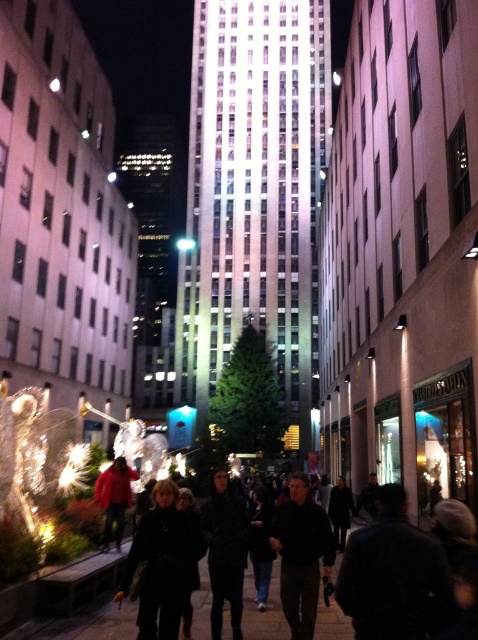
Is point (165, 522) positioned behind point (400, 529)?

Yes, it is behind point (400, 529).

Can you confirm if black leather coat at center is smaller than black matte crowd at center?

Indeed, black leather coat at center has a smaller size compared to black matte crowd at center.

Based on the photo, who is more distant from viewer, (x=152, y=513) or (x=250, y=634)?

Positioned behind is point (x=152, y=513).

Locate an element on the screen. This screenshot has width=478, height=640. black leather coat at center is located at coordinates (161, 564).

Does dark gray sweater at center have a larger size compared to black matte crowd at center?

Actually, dark gray sweater at center might be smaller than black matte crowd at center.

Does dark gray sweater at center appear on the left side of black matte crowd at center?

Incorrect, dark gray sweater at center is not on the left side of black matte crowd at center.

Is point (279, 518) in front of point (358, 528)?

Yes.

Where is `dark gray sweater at center`? The height and width of the screenshot is (640, 478). dark gray sweater at center is located at coordinates (301, 554).

Between point (304, 625) and point (115, 497), which one is positioned behind?

Positioned behind is point (115, 497).

Measure the distance between dark gray sweater at center and camera.

100.04 feet

Is point (322, 524) farther from viewer compared to point (102, 502)?

No, it is not.

Find the location of a particular element. The width and height of the screenshot is (478, 640). dark gray sweater at center is located at coordinates (301, 554).